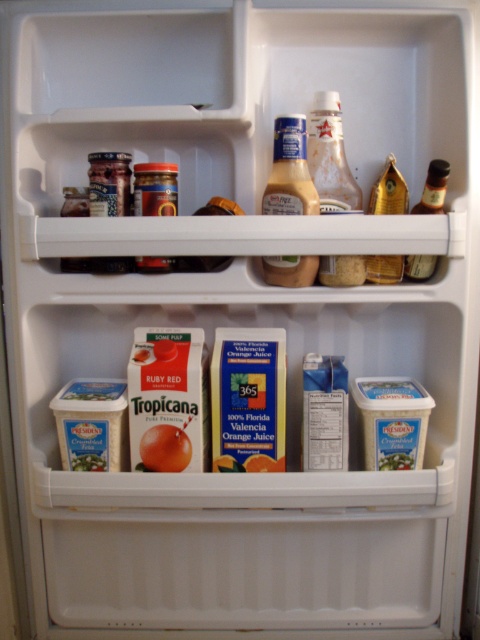
Between translucent glass bottle at upper center and matte plastic mustard at center, which one has less height?

With less height is matte plastic mustard at center.

Who is positioned more to the right, translucent glass bottle at upper center or matte plastic mustard at center?

From the viewer's perspective, translucent glass bottle at upper center appears more on the right side.

What do you see at coordinates (330, 157) in the screenshot? I see `translucent glass bottle at upper center` at bounding box center [330, 157].

Find the location of a particular element. The width and height of the screenshot is (480, 640). translucent glass bottle at upper center is located at coordinates (330, 157).

Can you confirm if translucent glass bottle at upper center is wider than translucent glass bottle at upper right?

Yes.

This screenshot has height=640, width=480. Describe the element at coordinates (330, 157) in the screenshot. I see `translucent glass bottle at upper center` at that location.

The height and width of the screenshot is (640, 480). What are the coordinates of `translucent glass bottle at upper center` in the screenshot? It's located at (330, 157).

The width and height of the screenshot is (480, 640). Describe the element at coordinates (289, 170) in the screenshot. I see `matte plastic mustard at center` at that location.

Locate an element on the screen. matte plastic mustard at center is located at coordinates (289, 170).

Between point (290, 170) and point (425, 269), which one is positioned in front?

Point (290, 170)

Image resolution: width=480 pixels, height=640 pixels. I want to click on matte plastic mustard at center, so click(x=289, y=170).